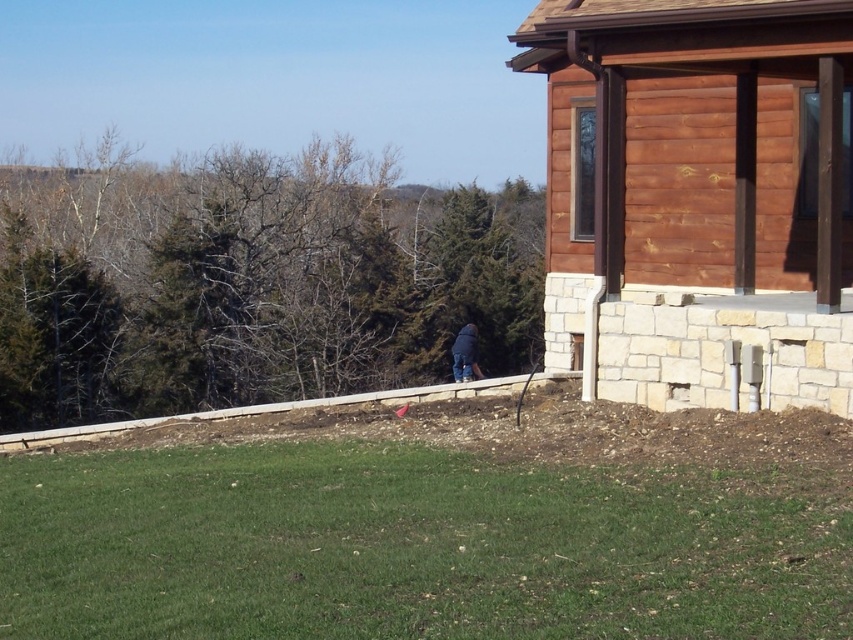
Question: Which point appears closest to the camera in this image?

Choices:
 (A) (471, 355)
 (B) (427, 621)

Answer: (B)

Question: Which of the following is the farthest from the observer?

Choices:
 (A) green grass at lower center
 (B) dark blue fabric at center

Answer: (B)

Question: Is green grass at lower center wider than dark blue fabric at center?

Choices:
 (A) no
 (B) yes

Answer: (A)

Question: Among these objects, which one is farthest from the camera?

Choices:
 (A) green grass at lower center
 (B) dark blue fabric at center

Answer: (B)

Question: Is green grass at lower center to the left of dark blue fabric at center from the viewer's perspective?

Choices:
 (A) yes
 (B) no

Answer: (A)

Question: Is green grass at lower center positioned at the back of dark blue fabric at center?

Choices:
 (A) no
 (B) yes

Answer: (A)